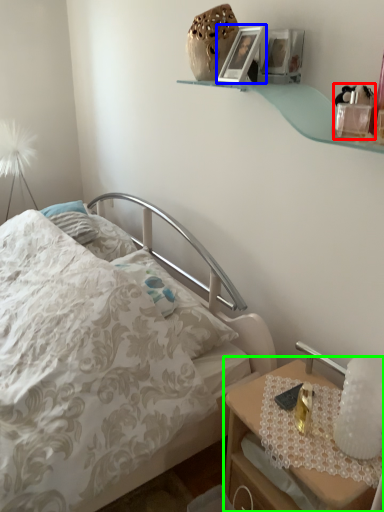
Question: Based on their relative distances, which object is farther from toy (highlighted by a red box)? Choose from picture frame (highlighted by a blue box) and nightstand (highlighted by a green box).

Choices:
 (A) picture frame
 (B) nightstand

Answer: (B)